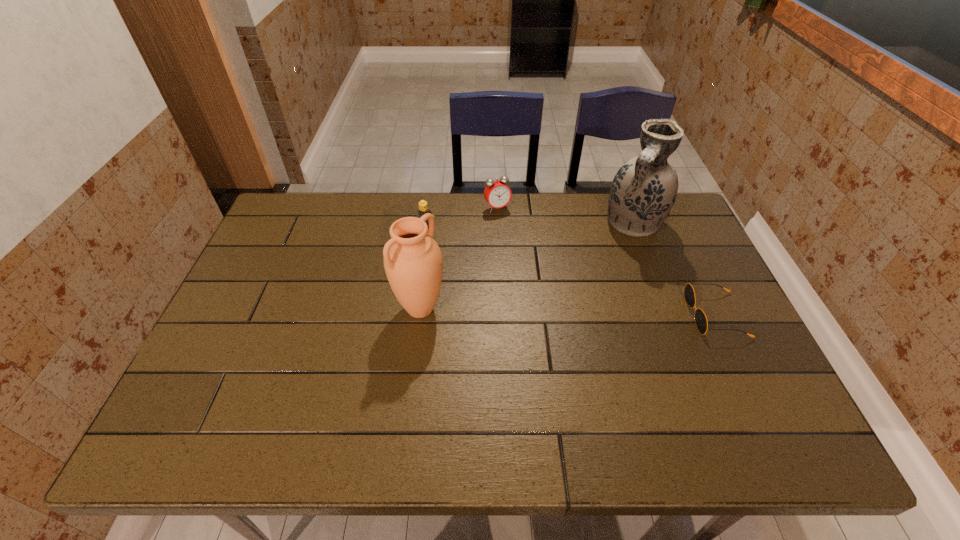
You are a GUI agent. You are given a task and a screenshot of the screen. Output one action in this format:
    pyautogui.click(x=<x>, y=<y>)
    Task: Click on the fourth shortest object
    The width and height of the screenshot is (960, 540).
    Given the screenshot: What is the action you would take?
    tap(413, 263)

The image size is (960, 540). I want to click on the shortest object, so click(700, 318).

Identify the location of alarm clock. The image size is (960, 540). (497, 193).

Locate an element on the screen. vase is located at coordinates (643, 191).

This screenshot has width=960, height=540. I want to click on Lego, so click(x=423, y=207).

Find the location of `vacant space located 0.120m on the front of the urn`. vacant space located 0.120m on the front of the urn is located at coordinates tap(413, 370).

The width and height of the screenshot is (960, 540). In order to click on vacant position located 0.350m on the front-facing side of the sunglasses in this screenshot , I will do (x=557, y=315).

In order to click on vacant region located 0.100m on the front-facing side of the sunglasses in this screenshot , I will do `click(652, 315)`.

This screenshot has height=540, width=960. In order to click on free space located 0.260m on the front-facing side of the sunglasses in this screenshot , I will do `click(591, 315)`.

Image resolution: width=960 pixels, height=540 pixels. What are the coordinates of `vacant region located 0.340m on the front-facing side of the alarm clock` in the screenshot? It's located at (545, 284).